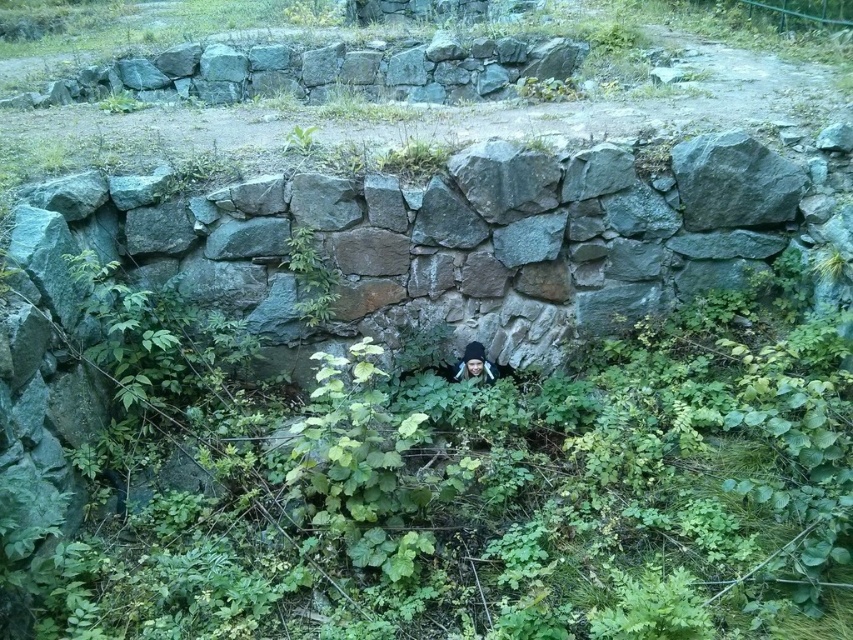
Is point (287, 268) positioned before point (468, 356)?

Yes, point (287, 268) is in front of point (468, 356).

You are a GUI agent. You are given a task and a screenshot of the screen. Output one action in this format:
    pyautogui.click(x=<x>, y=<y>)
    Task: Click on the green leafy plant at center
    The image size is (853, 640).
    Given the screenshot: What is the action you would take?
    pyautogui.click(x=310, y=276)

Is gray rough stone wall at upper center positioned at the back of black knit cap at center?

That is True.

Is gray rough stone wall at upper center below black knit cap at center?

No.

Is point (201, 54) more distant than point (468, 362)?

Yes.

Where is `gray rough stone wall at upper center`? This screenshot has width=853, height=640. gray rough stone wall at upper center is located at coordinates (323, 70).

Can you confirm if gray rough stone wall at upper center is bigger than green leafy plant at center?

Yes, gray rough stone wall at upper center is bigger than green leafy plant at center.

Consider the image. Is gray rough stone wall at upper center below green leafy plant at center?

No.

Is point (167, 68) closer to camera compared to point (300, 260)?

No, (167, 68) is further to viewer.

In order to click on gray rough stone wall at upper center in this screenshot , I will do `click(323, 70)`.